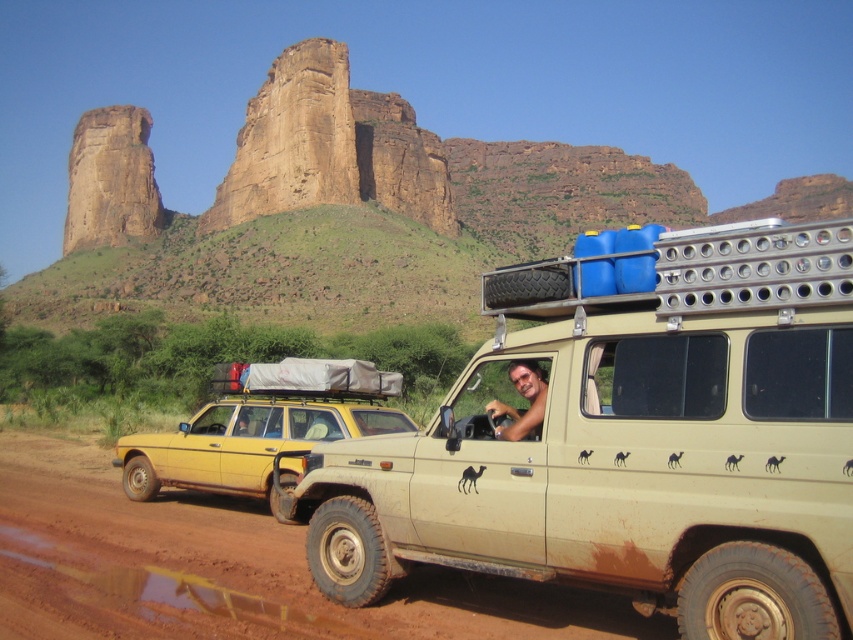
Which is below, beige matte suv at center or smooth tan skin at driver's seat?

beige matte suv at center

Is beige matte suv at center closer to camera compared to smooth tan skin at driver's seat?

That is True.

Identify the location of beige matte suv at center. (633, 442).

Which is more to the left, brown dirt track at lower left or smooth tan skin at driver's seat?

brown dirt track at lower left is more to the left.

Between brown dirt track at lower left and smooth tan skin at driver's seat, which one appears on the right side from the viewer's perspective?

smooth tan skin at driver's seat

Between point (44, 524) and point (500, 406), which one is positioned in front?

Point (500, 406) is in front.

Where is `brown dirt track at lower left`? The height and width of the screenshot is (640, 853). brown dirt track at lower left is located at coordinates (228, 570).

Is beige matte suv at center bigger than brown dirt track at lower left?

Yes.

Does beige matte suv at center have a lesser height compared to brown dirt track at lower left?

No.

Where is `beige matte suv at center`? The height and width of the screenshot is (640, 853). beige matte suv at center is located at coordinates click(633, 442).

This screenshot has height=640, width=853. Identify the location of beige matte suv at center. (633, 442).